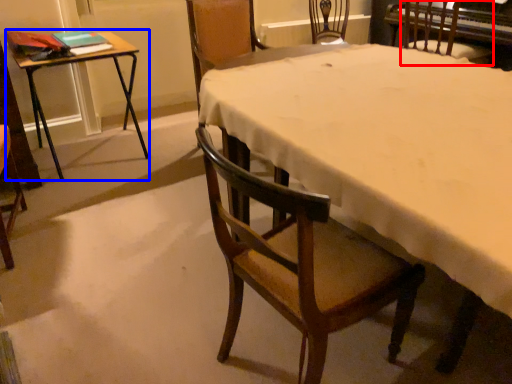
Question: Among these objects, which one is nearest to the camera, chair (highlighted by a red box) or table (highlighted by a blue box)?

Choices:
 (A) chair
 (B) table

Answer: (B)